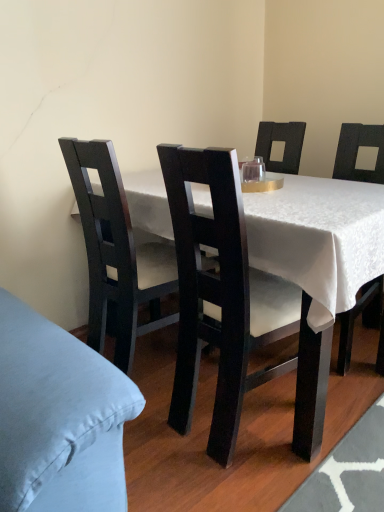
Question: Can you confirm if matte black table at center is taller than transparent glass at center?

Choices:
 (A) no
 (B) yes

Answer: (B)

Question: Is the position of matte black table at center more distant than that of transparent glass at center?

Choices:
 (A) no
 (B) yes

Answer: (A)

Question: Does matte black table at center appear on the left side of transparent glass at center?

Choices:
 (A) yes
 (B) no

Answer: (B)

Question: Would you consider matte black table at center to be distant from transparent glass at center?

Choices:
 (A) yes
 (B) no

Answer: (B)

Question: Does matte black table at center appear on the right side of transparent glass at center?

Choices:
 (A) no
 (B) yes

Answer: (B)

Question: Is matte black table at center wider than transparent glass at center?

Choices:
 (A) yes
 (B) no

Answer: (A)

Question: Is matte black chair at center, marked as the second chair in a left-to-right arrangement, wider than matte black chair at center, positioned as the 2th chair in right-to-left order?

Choices:
 (A) no
 (B) yes

Answer: (B)

Question: Does matte black chair at center, marked as the second chair in a left-to-right arrangement, appear on the left side of matte black chair at center, positioned as the 2th chair in right-to-left order?

Choices:
 (A) yes
 (B) no

Answer: (B)

Question: Is matte black chair at center, marked as the second chair in a left-to-right arrangement, positioned beyond the bounds of matte black chair at center, positioned as the 2th chair in right-to-left order?

Choices:
 (A) yes
 (B) no

Answer: (A)

Question: From a real-world perspective, is matte black chair at center, marked as the second chair in a left-to-right arrangement, on matte black chair at center, positioned as the 2th chair in right-to-left order?

Choices:
 (A) no
 (B) yes

Answer: (B)

Question: Considering the relative sizes of matte black chair at center, marked as the second chair in a left-to-right arrangement, and matte black chair at center, which is the first chair from left to right, in the image provided, is matte black chair at center, marked as the second chair in a left-to-right arrangement, shorter than matte black chair at center, which is the first chair from left to right,?

Choices:
 (A) no
 (B) yes

Answer: (A)

Question: Is matte black chair at center, marked as the second chair in a left-to-right arrangement, positioned in front of matte black chair at center, positioned as the 2th chair in right-to-left order?

Choices:
 (A) yes
 (B) no

Answer: (A)

Question: From the image's perspective, is matte black chair at center, marked as the second chair in a left-to-right arrangement, on top of transparent glass at center?

Choices:
 (A) no
 (B) yes

Answer: (A)